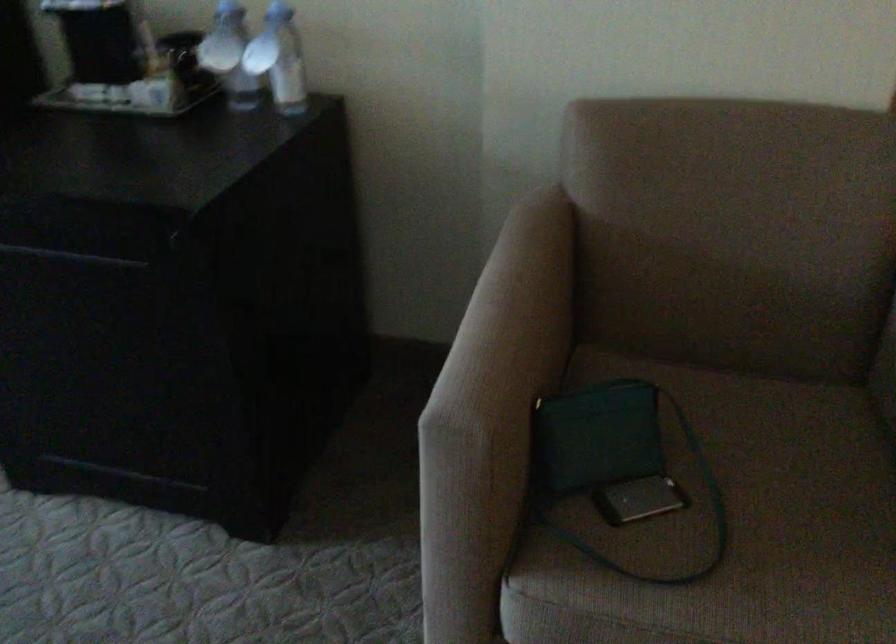
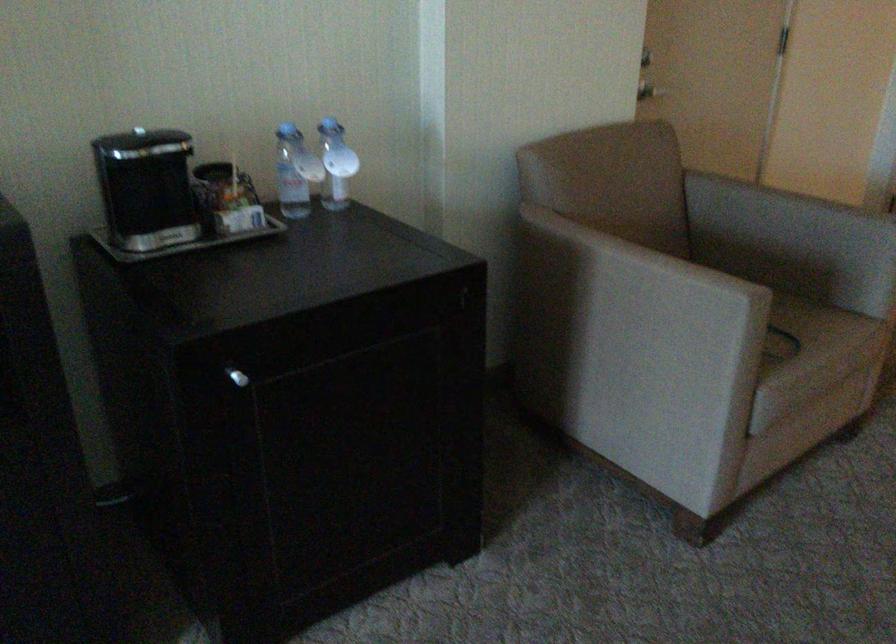
Question: I am providing you with two images of the same scene from different viewpoints. After the viewpoint changes to image2, which objects are now occluded?

Choices:
 (A) small silver handle
 (B) red latch handle
 (C) chair armrest
 (D) smartphone

Answer: (D)